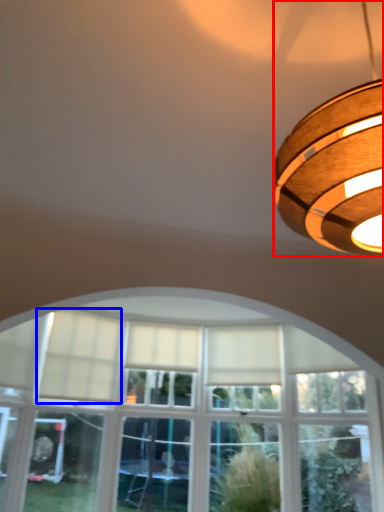
Question: Among these objects, which one is farthest to the camera, lamp (highlighted by a red box) or curtain (highlighted by a blue box)?

Choices:
 (A) lamp
 (B) curtain

Answer: (B)